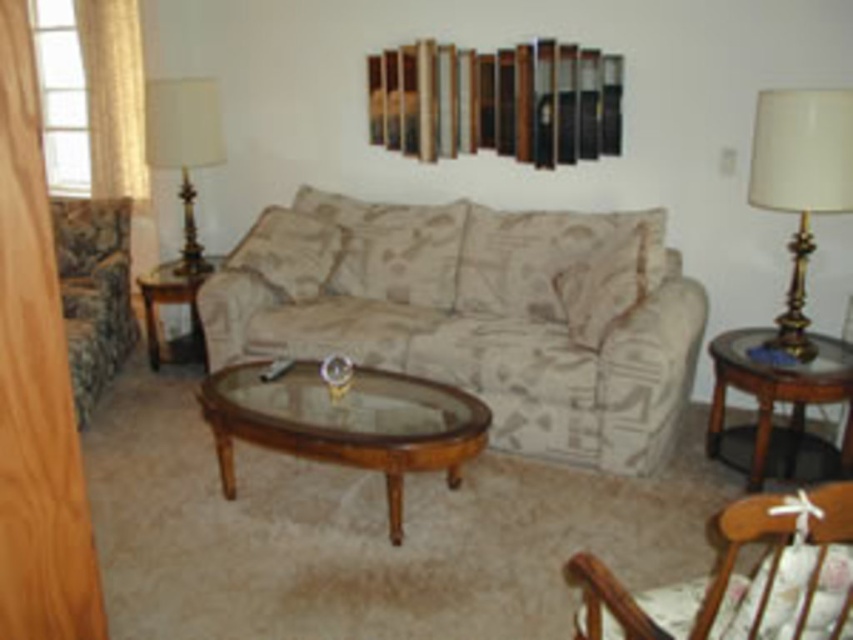
Which of these two, beige fabric couch at center or matte gold lamp at left, stands taller?

beige fabric couch at center

Which is more to the right, beige fabric couch at center or matte gold lamp at left?

beige fabric couch at center is more to the right.

Does point (492, 324) lie in front of point (169, 109)?

Yes, point (492, 324) is closer to viewer.

Where is `beige fabric couch at center`? This screenshot has height=640, width=853. beige fabric couch at center is located at coordinates (485, 316).

Does beige fabric couch at center have a greater width compared to transparent wood glass table at center?

Yes.

Where is `beige fabric couch at center`? The width and height of the screenshot is (853, 640). beige fabric couch at center is located at coordinates (485, 316).

Looking at this image, measure the distance between beige fabric couch at center and camera.

3.36 meters

In order to click on beige fabric couch at center in this screenshot , I will do `click(485, 316)`.

Which of these two, camouflage fabric couch at left or matte gold lamp at left, stands shorter?

matte gold lamp at left

Does point (77, 324) come farther from viewer compared to point (166, 96)?

No.

Measure the distance between camouflage fabric couch at left and camera.

A distance of 3.86 meters exists between camouflage fabric couch at left and camera.

The width and height of the screenshot is (853, 640). I want to click on camouflage fabric couch at left, so click(x=93, y=291).